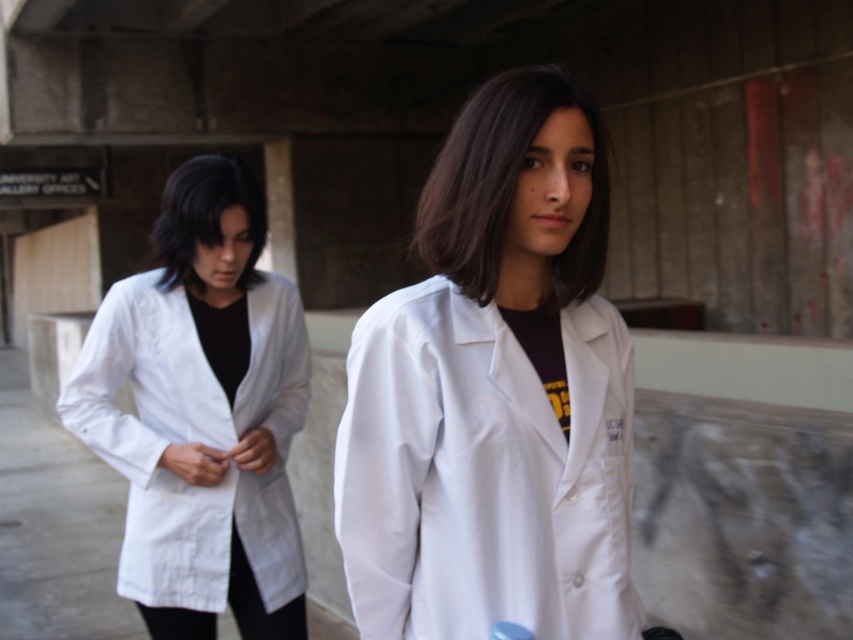
Question: Estimate the real-world distances between objects in this image. Which object is closer to the matte white lab coat at center?

Choices:
 (A) white cotton lab coat at left
 (B) smooth black hair at left

Answer: (A)

Question: Can you confirm if white cotton lab coat at left is smaller than matte white lab coat at center?

Choices:
 (A) no
 (B) yes

Answer: (A)

Question: Is white cotton lab coat at left thinner than matte white lab coat at center?

Choices:
 (A) yes
 (B) no

Answer: (B)

Question: Which is farther from the white cotton lab coat at left?

Choices:
 (A) white matte lab coat at center
 (B) smooth black hair at left

Answer: (A)

Question: Is matte white lab coat at center to the right of smooth black hair at left from the viewer's perspective?

Choices:
 (A) yes
 (B) no

Answer: (A)

Question: Which point is closer to the camera?

Choices:
 (A) (448, 211)
 (B) (68, 378)

Answer: (A)